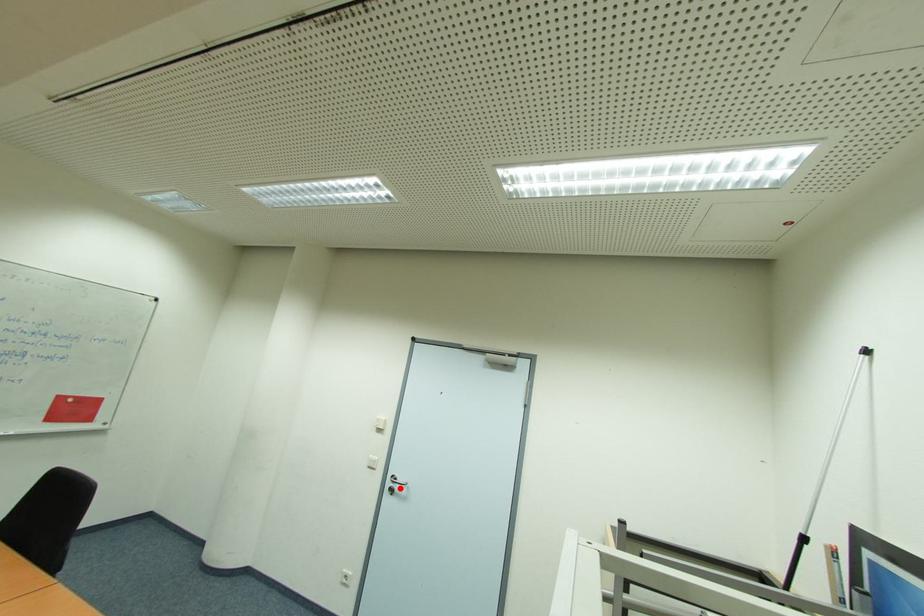
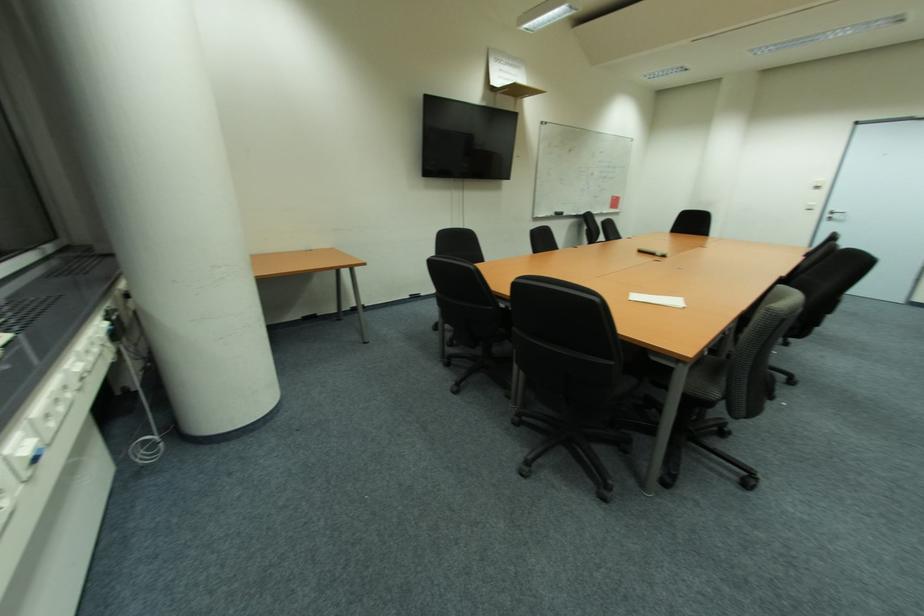
Locate, in the second image, the point that corresponds to the highlighted location in the first image.

(842, 217)